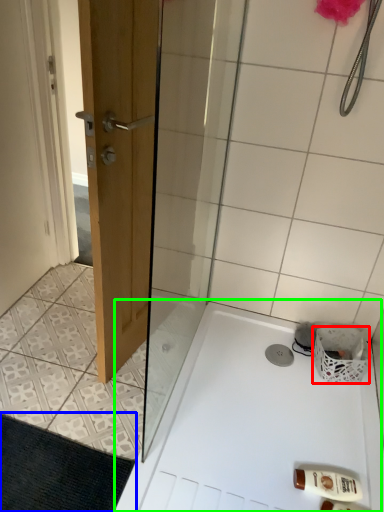
Question: Which object is the closest to the basket (highlighted by a red box)? Choose among these: bath mat (highlighted by a blue box) or bath (highlighted by a green box).

Choices:
 (A) bath mat
 (B) bath

Answer: (B)